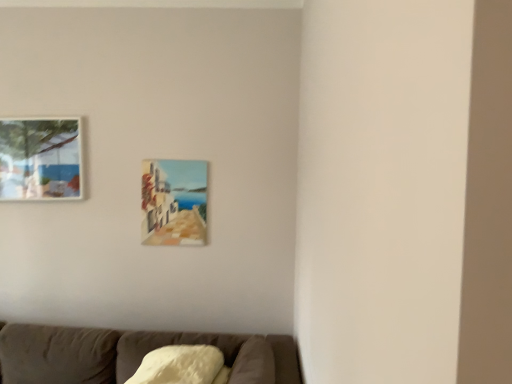
Describe the element at coordinates (41, 159) in the screenshot. I see `matte glass picture frame at upper left, which appears as the 2th picture frame when viewed from the right` at that location.

The width and height of the screenshot is (512, 384). I want to click on matte glass picture frame at upper left, the first picture frame positioned from the left, so click(x=41, y=159).

What is the approximate height of matte glass picture frame at upper left, which appears as the 2th picture frame when viewed from the right?

The height of matte glass picture frame at upper left, which appears as the 2th picture frame when viewed from the right, is 21.62 inches.

Locate an element on the screen. matte wooden picture frame at center, the first picture frame when ordered from right to left is located at coordinates (174, 202).

Describe the element at coordinates (174, 202) in the screenshot. The width and height of the screenshot is (512, 384). I see `matte wooden picture frame at center, the first picture frame when ordered from right to left` at that location.

Locate an element on the screen. The image size is (512, 384). matte glass picture frame at upper left, the first picture frame positioned from the left is located at coordinates [41, 159].

Based on their positions, is matte glass picture frame at upper left, the first picture frame positioned from the left, located to the left or right of matte wooden picture frame at center, the first picture frame when ordered from right to left?

Based on their positions, matte glass picture frame at upper left, the first picture frame positioned from the left, is located to the left of matte wooden picture frame at center, the first picture frame when ordered from right to left.

Who is more distant, matte glass picture frame at upper left, which appears as the 2th picture frame when viewed from the right, or matte wooden picture frame at center, positioned as the second picture frame in left-to-right order?

matte wooden picture frame at center, positioned as the second picture frame in left-to-right order, is further from the camera.

Between point (7, 177) and point (181, 221), which one is positioned behind?

The point (181, 221) is farther from the camera.

From the image's perspective, does matte glass picture frame at upper left, which appears as the 2th picture frame when viewed from the right, appear lower than matte wooden picture frame at center, the first picture frame when ordered from right to left?

No, from the image's perspective, matte glass picture frame at upper left, which appears as the 2th picture frame when viewed from the right, is not beneath matte wooden picture frame at center, the first picture frame when ordered from right to left.

From a real-world perspective, is matte glass picture frame at upper left, which appears as the 2th picture frame when viewed from the right, physically below matte wooden picture frame at center, positioned as the second picture frame in left-to-right order?

No, from a real-world perspective, matte glass picture frame at upper left, which appears as the 2th picture frame when viewed from the right, is not below matte wooden picture frame at center, positioned as the second picture frame in left-to-right order.

Can you confirm if matte glass picture frame at upper left, the first picture frame positioned from the left, is thinner than matte wooden picture frame at center, positioned as the second picture frame in left-to-right order?

No.

In terms of height, does matte glass picture frame at upper left, the first picture frame positioned from the left, look taller or shorter compared to matte wooden picture frame at center, positioned as the second picture frame in left-to-right order?

matte glass picture frame at upper left, the first picture frame positioned from the left, is shorter than matte wooden picture frame at center, positioned as the second picture frame in left-to-right order.

Does matte glass picture frame at upper left, the first picture frame positioned from the left, have a larger size compared to matte wooden picture frame at center, the first picture frame when ordered from right to left?

Indeed, matte glass picture frame at upper left, the first picture frame positioned from the left, has a larger size compared to matte wooden picture frame at center, the first picture frame when ordered from right to left.

Consider the image. Is matte glass picture frame at upper left, which appears as the 2th picture frame when viewed from the right, spatially inside matte wooden picture frame at center, the first picture frame when ordered from right to left, or outside of it?

matte glass picture frame at upper left, which appears as the 2th picture frame when viewed from the right, is spatially situated outside matte wooden picture frame at center, the first picture frame when ordered from right to left.

Is matte glass picture frame at upper left, which appears as the 2th picture frame when viewed from the right, beside matte wooden picture frame at center, positioned as the second picture frame in left-to-right order?

matte glass picture frame at upper left, which appears as the 2th picture frame when viewed from the right, and matte wooden picture frame at center, positioned as the second picture frame in left-to-right order, are clearly separated.

Does matte glass picture frame at upper left, which appears as the 2th picture frame when viewed from the right, turn towards matte wooden picture frame at center, positioned as the second picture frame in left-to-right order?

No, matte glass picture frame at upper left, which appears as the 2th picture frame when viewed from the right, is not aimed at matte wooden picture frame at center, positioned as the second picture frame in left-to-right order.

How many degrees apart are the facing directions of matte glass picture frame at upper left, the first picture frame positioned from the left, and matte wooden picture frame at center, positioned as the second picture frame in left-to-right order?

matte glass picture frame at upper left, the first picture frame positioned from the left, and matte wooden picture frame at center, positioned as the second picture frame in left-to-right order, are facing 0.00233 degrees away from each other.

Measure the distance from matte glass picture frame at upper left, which appears as the 2th picture frame when viewed from the right, to matte wooden picture frame at center, the first picture frame when ordered from right to left.

25.21 inches.

Locate an element on the screen. Image resolution: width=512 pixels, height=384 pixels. picture frame above the matte wooden picture frame at center, positioned as the second picture frame in left-to-right order (from the image's perspective) is located at coordinates 41,159.

From the picture: Can you confirm if matte wooden picture frame at center, positioned as the second picture frame in left-to-right order, is positioned to the left of matte glass picture frame at upper left, the first picture frame positioned from the left?

In fact, matte wooden picture frame at center, positioned as the second picture frame in left-to-right order, is to the right of matte glass picture frame at upper left, the first picture frame positioned from the left.

Is matte wooden picture frame at center, the first picture frame when ordered from right to left, in front of or behind matte glass picture frame at upper left, which appears as the 2th picture frame when viewed from the right, in the image?

Visually, matte wooden picture frame at center, the first picture frame when ordered from right to left, is located behind matte glass picture frame at upper left, which appears as the 2th picture frame when viewed from the right.

Does point (144, 230) lie in front of point (31, 169)?

No, it is behind (31, 169).

From the image's perspective, between matte wooden picture frame at center, the first picture frame when ordered from right to left, and matte glass picture frame at upper left, the first picture frame positioned from the left, who is located below?

From the image's view, matte wooden picture frame at center, the first picture frame when ordered from right to left, is below.

From a real-world perspective, is matte wooden picture frame at center, positioned as the second picture frame in left-to-right order, on top of matte glass picture frame at upper left, which appears as the 2th picture frame when viewed from the right?

No, from a real-world perspective, matte wooden picture frame at center, positioned as the second picture frame in left-to-right order, is not on top of matte glass picture frame at upper left, which appears as the 2th picture frame when viewed from the right.

Does matte wooden picture frame at center, positioned as the second picture frame in left-to-right order, have a greater width compared to matte glass picture frame at upper left, the first picture frame positioned from the left?

No, matte wooden picture frame at center, positioned as the second picture frame in left-to-right order, is not wider than matte glass picture frame at upper left, the first picture frame positioned from the left.

Considering the relative sizes of matte wooden picture frame at center, the first picture frame when ordered from right to left, and matte glass picture frame at upper left, which appears as the 2th picture frame when viewed from the right, in the image provided, is matte wooden picture frame at center, the first picture frame when ordered from right to left, taller than matte glass picture frame at upper left, which appears as the 2th picture frame when viewed from the right,?

Yes, matte wooden picture frame at center, the first picture frame when ordered from right to left, is taller than matte glass picture frame at upper left, which appears as the 2th picture frame when viewed from the right.

Which of these two, matte wooden picture frame at center, the first picture frame when ordered from right to left, or matte glass picture frame at upper left, which appears as the 2th picture frame when viewed from the right, is bigger?

matte glass picture frame at upper left, which appears as the 2th picture frame when viewed from the right, is bigger.

Is matte glass picture frame at upper left, which appears as the 2th picture frame when viewed from the right, inside matte wooden picture frame at center, the first picture frame when ordered from right to left?

No, matte wooden picture frame at center, the first picture frame when ordered from right to left, does not contain matte glass picture frame at upper left, which appears as the 2th picture frame when viewed from the right.

Would you consider matte wooden picture frame at center, the first picture frame when ordered from right to left, to be distant from matte glass picture frame at upper left, the first picture frame positioned from the left?

No, matte wooden picture frame at center, the first picture frame when ordered from right to left, is not far from matte glass picture frame at upper left, the first picture frame positioned from the left.

Could you tell me if matte wooden picture frame at center, positioned as the second picture frame in left-to-right order, is turned towards matte glass picture frame at upper left, the first picture frame positioned from the left?

No, matte wooden picture frame at center, positioned as the second picture frame in left-to-right order, does not turn towards matte glass picture frame at upper left, the first picture frame positioned from the left.

How different are the orientations of matte wooden picture frame at center, positioned as the second picture frame in left-to-right order, and matte glass picture frame at upper left, the first picture frame positioned from the left, in degrees?

0.00233 degrees separate the facing orientations of matte wooden picture frame at center, positioned as the second picture frame in left-to-right order, and matte glass picture frame at upper left, the first picture frame positioned from the left.

Measure the distance between matte wooden picture frame at center, the first picture frame when ordered from right to left, and matte glass picture frame at upper left, the first picture frame positioned from the left.

The distance of matte wooden picture frame at center, the first picture frame when ordered from right to left, from matte glass picture frame at upper left, the first picture frame positioned from the left, is 25.21 inches.

Identify the location of picture frame above the matte wooden picture frame at center, positioned as the second picture frame in left-to-right order (from the image's perspective). (41, 159).

Identify the location of picture frame below the matte glass picture frame at upper left, which appears as the 2th picture frame when viewed from the right (from a real-world perspective). Image resolution: width=512 pixels, height=384 pixels. (174, 202).

This screenshot has width=512, height=384. There is a matte wooden picture frame at center, positioned as the second picture frame in left-to-right order. Identify the location of picture frame above it (from a real-world perspective). (41, 159).